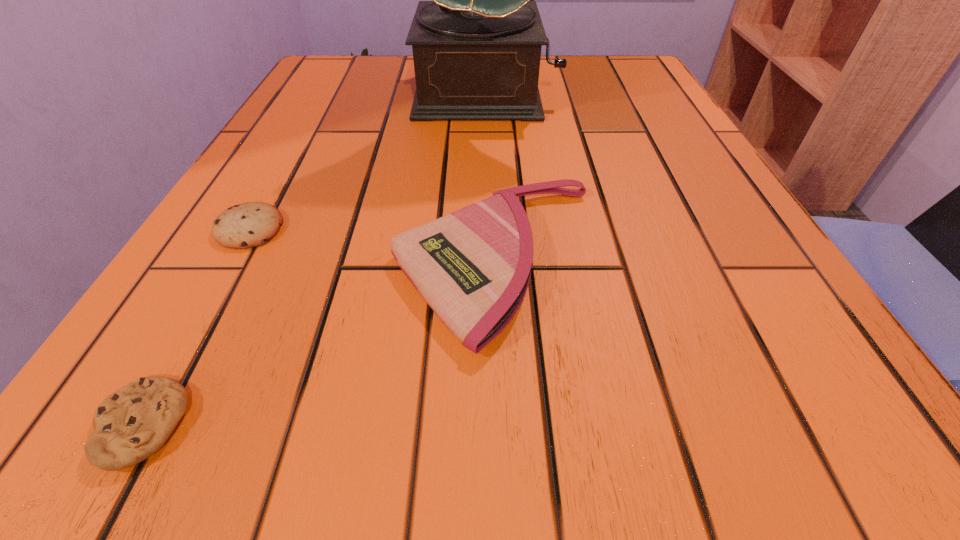
Image resolution: width=960 pixels, height=540 pixels. Find the location of `vacant region that satisfies the following two spatial constraints: 1. on the back side of the wristlet; 2. on the right side of the nearest object`. vacant region that satisfies the following two spatial constraints: 1. on the back side of the wristlet; 2. on the right side of the nearest object is located at coordinates (233, 261).

The image size is (960, 540). Identify the location of free spot that satisfies the following two spatial constraints: 1. on the horn of the second tallest object; 2. on the right side of the farthest object. (491, 261).

Find the location of a particular element. The image size is (960, 540). vacant region that satisfies the following two spatial constraints: 1. on the horn of the wristlet; 2. on the right side of the farthest object is located at coordinates (491, 261).